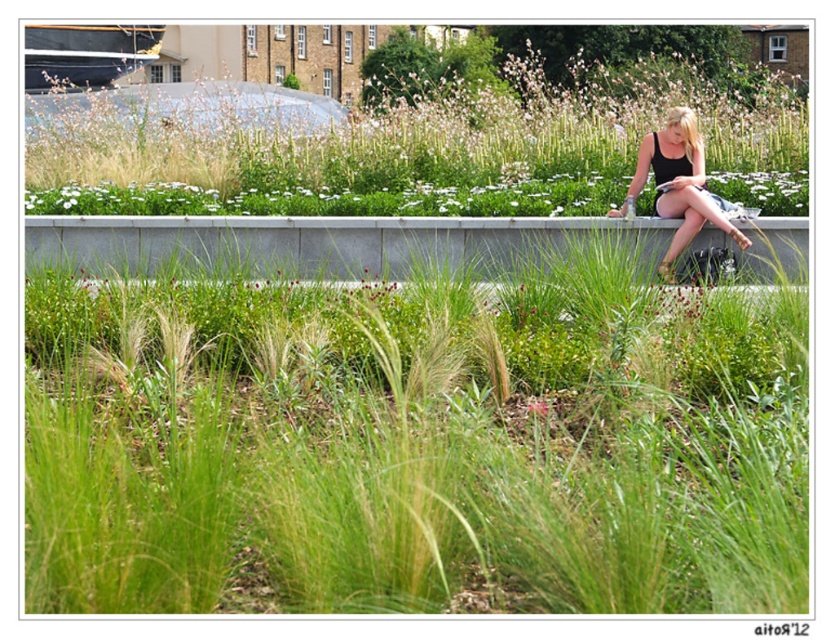
You are standing in the garden and notice the green grass at center and the black matte tank top at upper right. Which object appears narrower in the image?

The green grass at center appears narrower than the black matte tank top at upper right because it has a lesser width according to the description.

You are standing in the garden bed with grasses and low plants. You want to reach the gray concrete ledge at upper center. According to the coordinates provided, where should you head to reach it?

The gray concrete ledge at upper center is located at point (330, 243), so you should head towards that coordinate to reach it.

You are standing in the garden and want to place a small potted plant on the gray concrete ledge at upper center. However, there is a person wearing a black matte tank top at upper right. Can you place the potted plant on the ledge without it being under the person?

The gray concrete ledge at upper center is below the black matte tank top at upper right, so placing the potted plant on the ledge would position it under the person. Therefore, the potted plant cannot be placed there without being under the person.